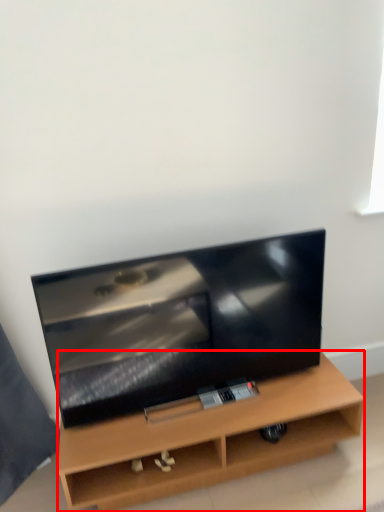
Question: From the image's perspective, considering the relative positions of furniture (annotated by the red box) and television in the image provided, where is furniture (annotated by the red box) located with respect to the staircase?

Choices:
 (A) below
 (B) above

Answer: (A)